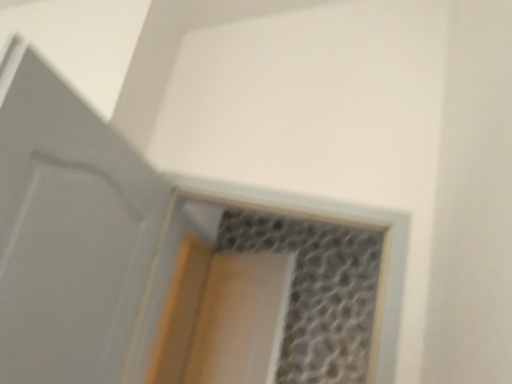
Question: Is translucent glass window at center positioned behind white matte door at left?

Choices:
 (A) yes
 (B) no

Answer: (A)

Question: From the image's perspective, is translucent glass window at center over white matte door at left?

Choices:
 (A) no
 (B) yes

Answer: (A)

Question: Is there a large distance between translucent glass window at center and white matte door at left?

Choices:
 (A) no
 (B) yes

Answer: (A)

Question: Is translucent glass window at center wider than white matte door at left?

Choices:
 (A) yes
 (B) no

Answer: (A)

Question: Does translucent glass window at center have a lesser width compared to white matte door at left?

Choices:
 (A) no
 (B) yes

Answer: (A)

Question: From a real-world perspective, is clear plastic screen door at center positioned above or below translucent glass window at center?

Choices:
 (A) below
 (B) above

Answer: (A)

Question: From the image's perspective, is clear plastic screen door at center positioned above or below translucent glass window at center?

Choices:
 (A) above
 (B) below

Answer: (B)

Question: Considering the positions of clear plastic screen door at center and translucent glass window at center in the image, is clear plastic screen door at center wider or thinner than translucent glass window at center?

Choices:
 (A) wide
 (B) thin

Answer: (B)

Question: From their relative heights in the image, would you say clear plastic screen door at center is taller or shorter than translucent glass window at center?

Choices:
 (A) tall
 (B) short

Answer: (A)

Question: Considering the positions of clear plastic screen door at center and white matte door at left in the image, is clear plastic screen door at center bigger or smaller than white matte door at left?

Choices:
 (A) small
 (B) big

Answer: (A)

Question: From a real-world perspective, relative to white matte door at left, is clear plastic screen door at center vertically above or below?

Choices:
 (A) below
 (B) above

Answer: (A)

Question: From their relative heights in the image, would you say clear plastic screen door at center is taller or shorter than white matte door at left?

Choices:
 (A) tall
 (B) short

Answer: (A)

Question: Considering the positions of clear plastic screen door at center and white matte door at left in the image, is clear plastic screen door at center wider or thinner than white matte door at left?

Choices:
 (A) wide
 (B) thin

Answer: (B)

Question: From their relative heights in the image, would you say translucent glass window at center is taller or shorter than clear plastic screen door at center?

Choices:
 (A) tall
 (B) short

Answer: (B)

Question: Looking at their shapes, would you say translucent glass window at center is wider or thinner than clear plastic screen door at center?

Choices:
 (A) thin
 (B) wide

Answer: (B)